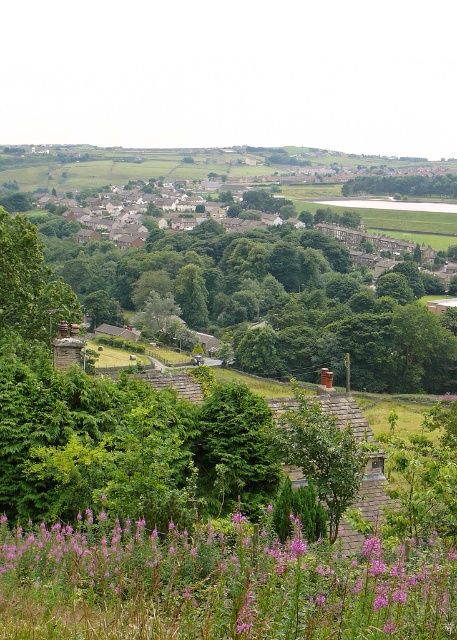
Question: Is purple soft-textured flowers at lower center to the left of green leafy tree at center from the viewer's perspective?

Choices:
 (A) no
 (B) yes

Answer: (B)

Question: Which of the following is the farthest from the observer?

Choices:
 (A) purple soft-textured flowers at lower center
 (B) green leafy tree at center

Answer: (B)

Question: Which object appears closest to the camera in this image?

Choices:
 (A) purple soft-textured flowers at lower center
 (B) green leafy tree at center

Answer: (A)

Question: Is purple soft-textured flowers at lower center positioned behind green leafy tree at center?

Choices:
 (A) yes
 (B) no

Answer: (B)

Question: Does purple soft-textured flowers at lower center come behind green leafy tree at center?

Choices:
 (A) yes
 (B) no

Answer: (B)